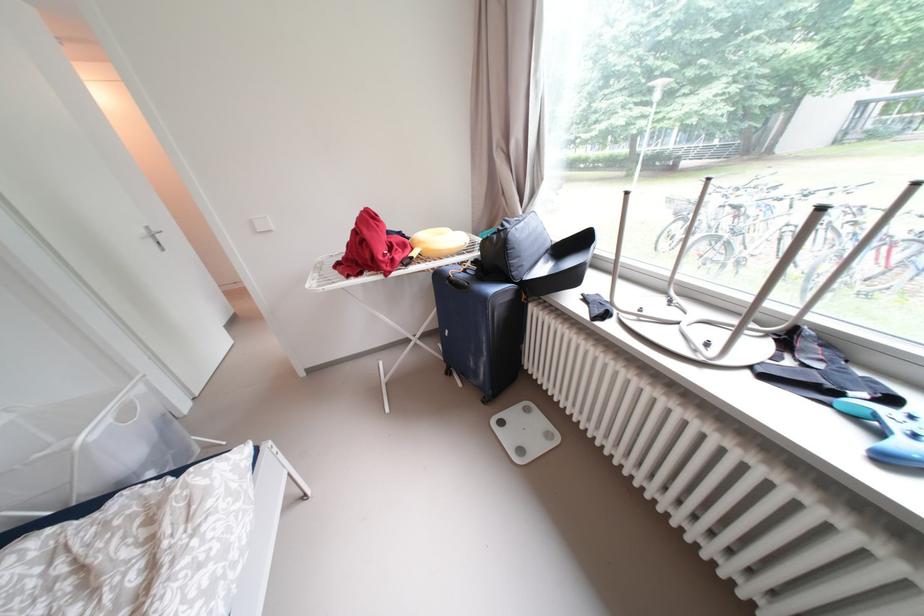
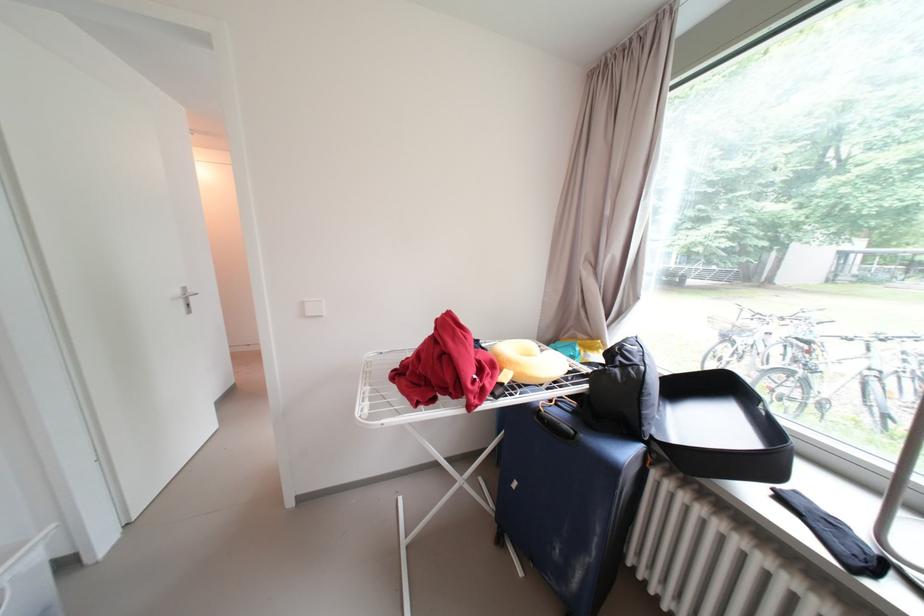
In a continuous first-person perspective shot, in which direction is the camera moving?

The cameraman walked toward left, forward.